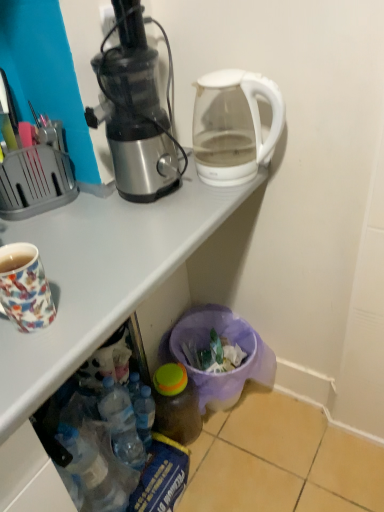
You are a GUI agent. You are given a task and a screenshot of the screen. Output one action in this format:
    pyautogui.click(x=<x>, y=<y>)
    Task: Click on the vacant space that's between multicolored ceramic mug at left and metallic silver juicer at left
    
    Given the screenshot: What is the action you would take?
    pyautogui.click(x=99, y=246)